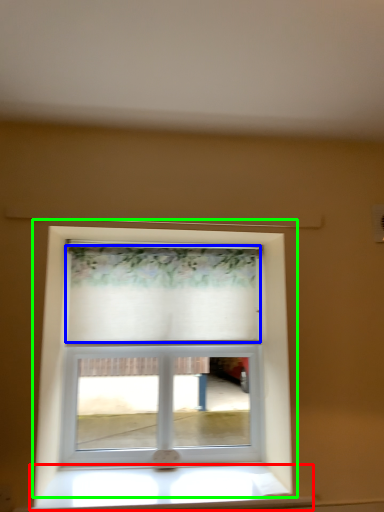
Question: Which is farther away from window sill (highlighted by a red box)? curtain (highlighted by a blue box) or window (highlighted by a green box)?

Choices:
 (A) curtain
 (B) window

Answer: (A)